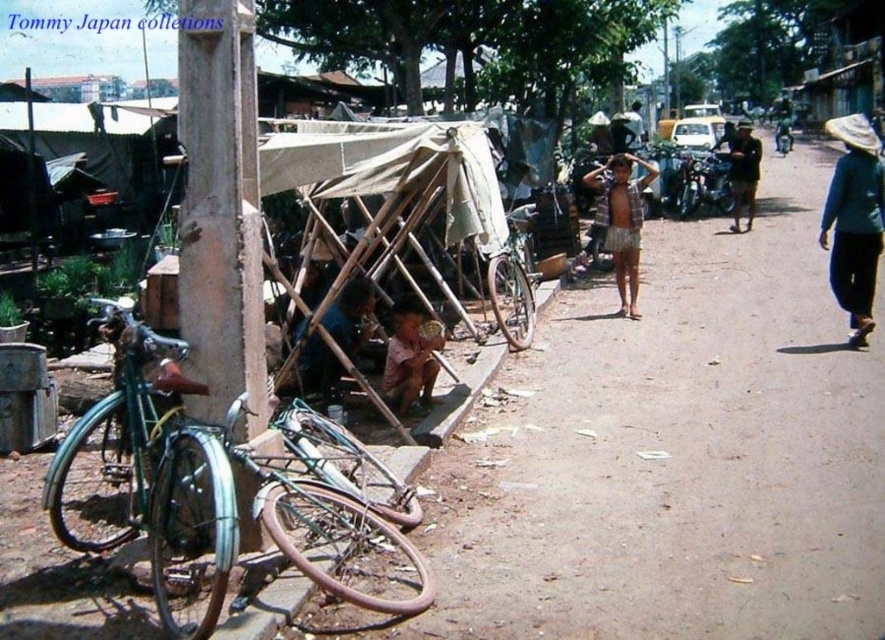
Question: Based on their relative distances, which object is farther from the green metallic motorcycle at right?

Choices:
 (A) brown textured shirt at lower center
 (B) plaid shirt at center
 (C) shiny chrome motorcycle at center-right

Answer: (A)

Question: Which point is farther to the camera?

Choices:
 (A) green metallic motorcycle at right
 (B) blue fabric hat at right
 (C) green metallic bicycle at lower left
 (D) plaid shirt at center

Answer: (A)

Question: Which point appears farthest from the camera in this image?

Choices:
 (A) (724, 163)
 (B) (783, 131)

Answer: (B)

Question: Can you confirm if dark blue fabric at center is positioned to the right of brown textured shirt at lower center?

Choices:
 (A) no
 (B) yes

Answer: (A)

Question: Can you confirm if blue fabric hat at right is positioned to the right of brown straw hat at right?

Choices:
 (A) no
 (B) yes

Answer: (B)

Question: Can you confirm if shiny chrome motorcycle at center-right is bigger than brown straw hat at right?

Choices:
 (A) yes
 (B) no

Answer: (B)